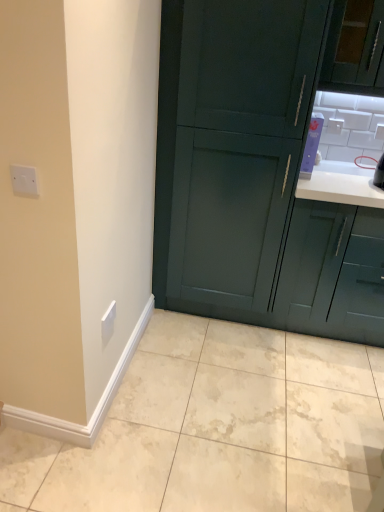
Question: Is dark green wood cabinet at center, placed as the 2th cabinetry when sorted from right to left, at the left side of beige marble tile at lower center?

Choices:
 (A) yes
 (B) no

Answer: (B)

Question: From a real-world perspective, is dark green wood cabinet at center, which appears as the first cabinetry when viewed from the left, positioned over beige marble tile at lower center based on gravity?

Choices:
 (A) yes
 (B) no

Answer: (A)

Question: Does dark green wood cabinet at center, placed as the 2th cabinetry when sorted from right to left, touch beige marble tile at lower center?

Choices:
 (A) yes
 (B) no

Answer: (B)

Question: From a real-world perspective, does dark green wood cabinet at center, placed as the 2th cabinetry when sorted from right to left, sit lower than beige marble tile at lower center?

Choices:
 (A) yes
 (B) no

Answer: (B)

Question: Does dark green wood cabinet at center, placed as the 2th cabinetry when sorted from right to left, have a greater height compared to beige marble tile at lower center?

Choices:
 (A) yes
 (B) no

Answer: (A)

Question: Is white plastic electric outlet at upper right, which appears as the 3th electric outlet when ordered from the bottom, in front of or behind beige marble tile at lower center in the image?

Choices:
 (A) behind
 (B) front

Answer: (A)

Question: Is point (380, 125) positioned closer to the camera than point (6, 475)?

Choices:
 (A) closer
 (B) farther

Answer: (B)

Question: From a real-world perspective, is white plastic electric outlet at upper right, which appears as the 4th electric outlet when viewed from the left, physically located above or below beige marble tile at lower center?

Choices:
 (A) above
 (B) below

Answer: (A)

Question: In terms of width, does white plastic electric outlet at upper right, which ranks as the second electric outlet in top-to-bottom order, look wider or thinner when compared to beige marble tile at lower center?

Choices:
 (A) wide
 (B) thin

Answer: (B)

Question: From a real-world perspective, is white plastic electric outlet at lower left, the second electric outlet viewed from the left, physically located above or below white plastic electric outlet at upper left, which is counted as the 4th electric outlet, starting from the back?

Choices:
 (A) below
 (B) above

Answer: (A)

Question: Looking at their shapes, would you say white plastic electric outlet at lower left, the 2th electric outlet when ordered from front to back, is wider or thinner than white plastic electric outlet at upper left, acting as the 1th electric outlet starting from the front?

Choices:
 (A) wide
 (B) thin

Answer: (A)

Question: Considering the positions of white plastic electric outlet at lower left, which is counted as the 1th electric outlet, starting from the bottom, and white plastic electric outlet at upper left, which is counted as the 4th electric outlet, starting from the back, in the image, is white plastic electric outlet at lower left, which is counted as the 1th electric outlet, starting from the bottom, bigger or smaller than white plastic electric outlet at upper left, which is counted as the 4th electric outlet, starting from the back,?

Choices:
 (A) small
 (B) big

Answer: (B)

Question: From the image's perspective, is white plastic electric outlet at lower left, the 2th electric outlet when ordered from front to back, located above or below white plastic electric outlet at upper left, arranged as the first electric outlet when viewed from the left?

Choices:
 (A) above
 (B) below

Answer: (B)

Question: Visually, is beige marble tile at lower center positioned to the left or to the right of matte teal cabinet at upper right, the second cabinetry in the left-to-right sequence?

Choices:
 (A) left
 (B) right

Answer: (A)

Question: Considering their positions, is beige marble tile at lower center located in front of or behind matte teal cabinet at upper right, which ranks as the 1th cabinetry in right-to-left order?

Choices:
 (A) behind
 (B) front

Answer: (B)